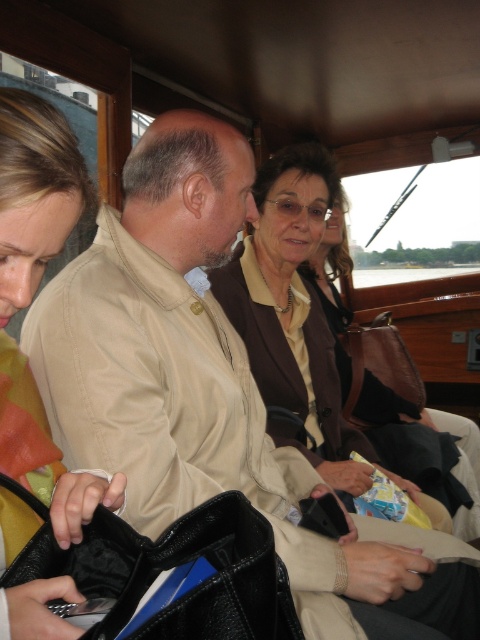
You are a tour guide on a boat and need to hand out maps to two tourists. The tourists are holding the black leather bag at lower left and wearing the brown leather jacket at center. If the distance between them is 5.35 feet, can you reach both tourists with a 6 feet long map dispenser that you hold in your hand?

The black leather bag at lower left is 5.35 feet from the brown leather jacket at center. Since the map dispenser is 6 feet long, you can extend it to reach both tourists as the distance between them is less than the dispenser length.

You are a tour guide standing on the deck of the boat. You need to hand out a map to the person wearing the matte yellow jacket at left and then to the person wearing the brown leather jacket at center. Can you reach both of them without moving from your current position if your arm can extend 1.5 meters?

The distance between the matte yellow jacket at left and the brown leather jacket at center is 1.67 meters. Since your arm can only extend 1.5 meters, you cannot reach both without moving. You will need to move closer to hand the map to the person wearing the brown leather jacket at center after the first person.

You are a photographer on a boat and need to capture a photo of the matte yellow jacket at left and the black leather bag at lower left without any obstructions. Based on their positions, which object should you focus on first to ensure both are in frame?

The matte yellow jacket at left is positioned on the left side of black leather bag at lower left, so focusing on the matte yellow jacket at left first will ensure the black leather bag at lower left remains in the frame to its right.